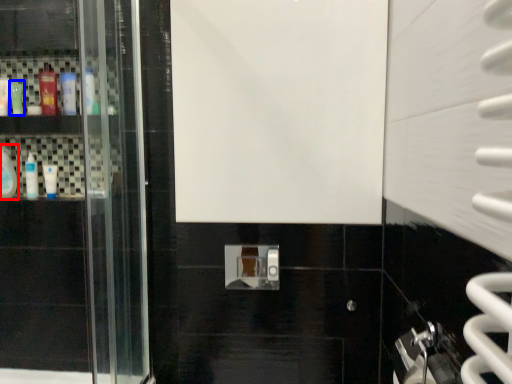
Question: Which object is closer to the camera taking this photo, mouthwash (highlighted by a red box) or mouthwash (highlighted by a blue box)?

Choices:
 (A) mouthwash
 (B) mouthwash

Answer: (B)